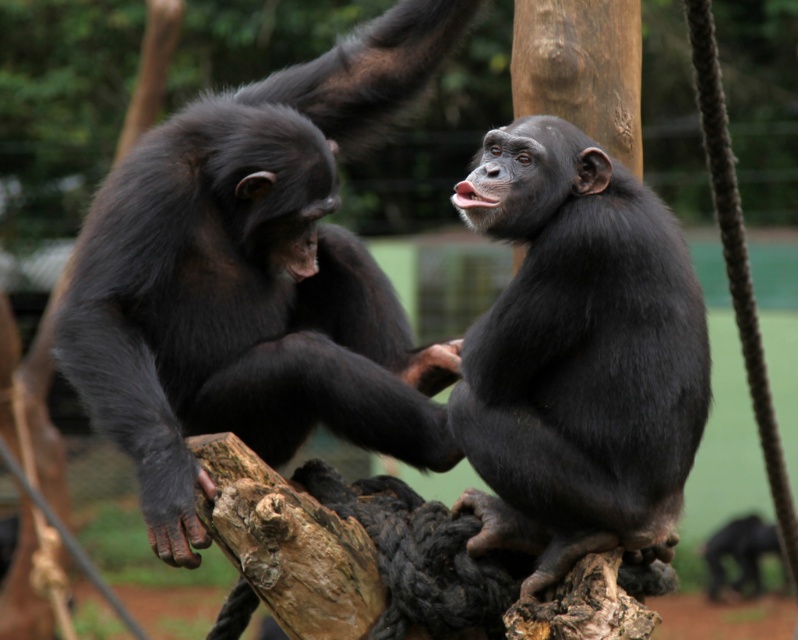
You are a zookeeper observing two chimpanzees in their enclosure. You notice a shiny black monkey at upper right and a shiny black monkey at center. Which of these two monkeys is located higher up in the wooden structure?

The shiny black monkey at upper right is positioned over the shiny black monkey at center, so it is higher up in the wooden structure.

You are a zookeeper standing at the entrance of the chimpanzee enclosure. You want to toss a banana to the shiny black monkey at upper right. The banana can travel 3 meters. Will it reach the monkey?

The shiny black monkey at upper right and viewer are 3.69 meters apart. The banana can only travel 3 meters, so it won not reach the monkey.

You are a zookeeper observing two chimpanzees in their enclosure. You see the shiny black monkey at upper right and the shiny black monkey at center. Which chimpanzee is larger in size?

The shiny black monkey at upper right is bigger than the shiny black monkey at center.